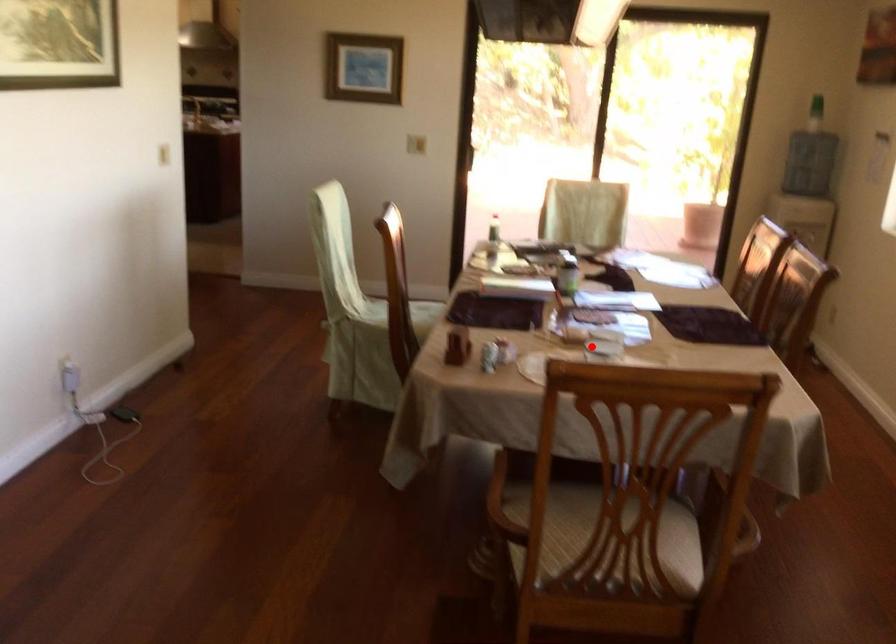
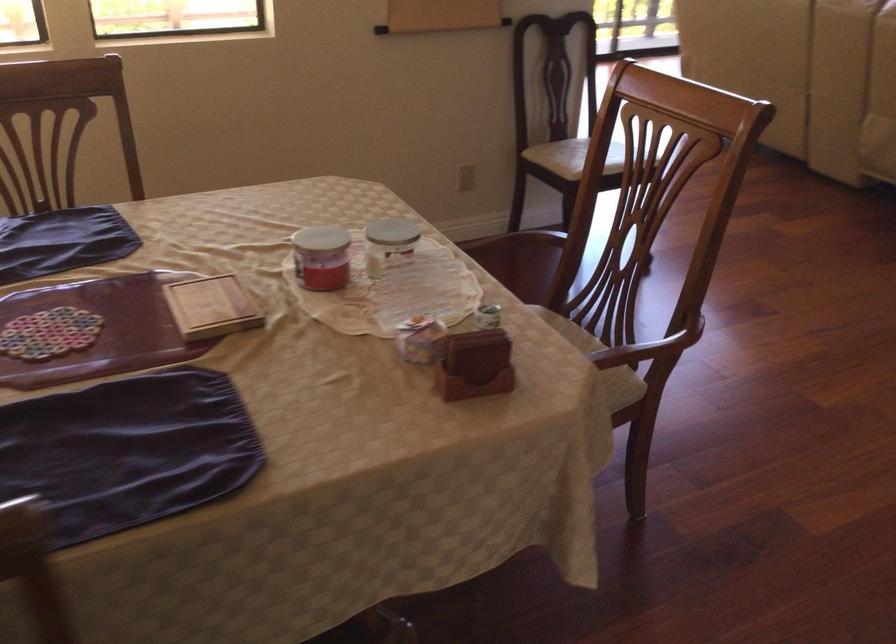
Question: A red point is marked in image1. In image2, is the corresponding 3D point closer to the camera or farther? Reply with the corresponding letter.

Choices:
 (A) The corresponding 3D point is closer.
 (B) The corresponding 3D point is farther.

Answer: (A)